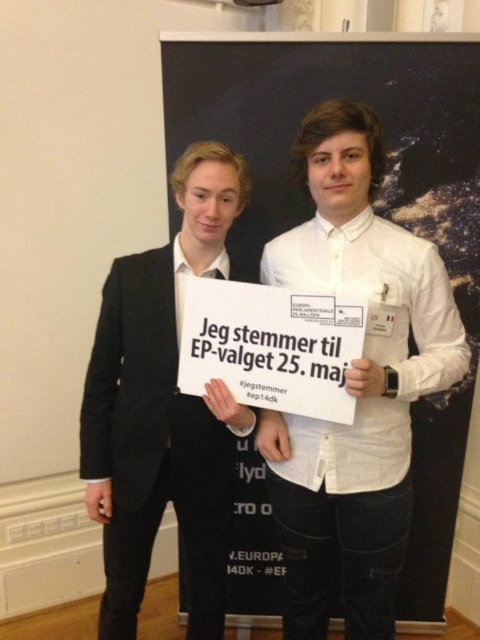
Does white cotton shirt at center lie in front of black matte suit at center?

Yes.

Does white cotton shirt at center have a smaller size compared to black matte suit at center?

No.

Which is behind, point (442, 296) or point (210, 435)?

Point (210, 435)

Identify the location of white cotton shirt at center. (355, 385).